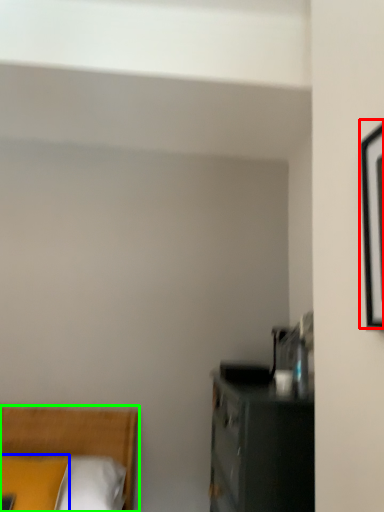
Question: Considering the real-world distances, which object is farthest from picture frame (highlighted by a red box)? pillow (highlighted by a blue box) or bed (highlighted by a green box)?

Choices:
 (A) pillow
 (B) bed

Answer: (B)